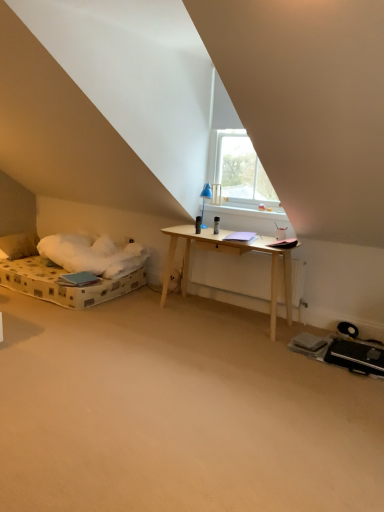
Question: Would you say transparent glass window at upper center is outside beige carpet at center?

Choices:
 (A) yes
 (B) no

Answer: (A)

Question: From a real-world perspective, is transparent glass window at upper center on beige carpet at center?

Choices:
 (A) yes
 (B) no

Answer: (A)

Question: Is transparent glass window at upper center further to camera compared to beige carpet at center?

Choices:
 (A) yes
 (B) no

Answer: (A)

Question: From the image's perspective, is transparent glass window at upper center over beige carpet at center?

Choices:
 (A) no
 (B) yes

Answer: (B)

Question: Is transparent glass window at upper center far away from beige carpet at center?

Choices:
 (A) no
 (B) yes

Answer: (B)

Question: Can you confirm if transparent glass window at upper center is thinner than beige carpet at center?

Choices:
 (A) no
 (B) yes

Answer: (B)

Question: Does soft white pillow at left lie in front of beige carpet at center?

Choices:
 (A) yes
 (B) no

Answer: (B)

Question: Can you confirm if soft white pillow at left is shorter than beige carpet at center?

Choices:
 (A) yes
 (B) no

Answer: (B)

Question: Considering the relative sizes of soft white pillow at left and beige carpet at center in the image provided, is soft white pillow at left bigger than beige carpet at center?

Choices:
 (A) yes
 (B) no

Answer: (B)

Question: Is soft white pillow at left beside beige carpet at center?

Choices:
 (A) no
 (B) yes

Answer: (A)

Question: Is soft white pillow at left positioned behind beige carpet at center?

Choices:
 (A) no
 (B) yes

Answer: (B)

Question: Is beige carpet at center located within soft white pillow at left?

Choices:
 (A) yes
 (B) no

Answer: (B)

Question: Would you say soft white pillow at left contains transparent glass window at upper center?

Choices:
 (A) no
 (B) yes

Answer: (A)